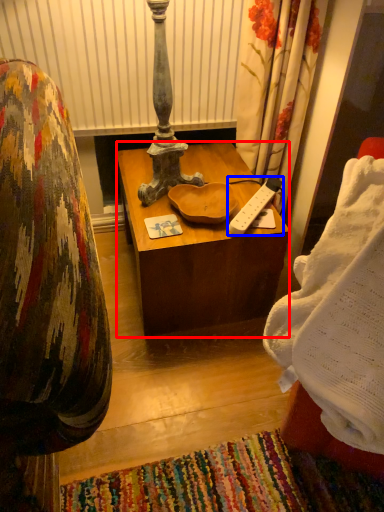
Question: Among these objects, which one is nearest to the camera, desk (highlighted by a red box) or remote control (highlighted by a blue box)?

Choices:
 (A) desk
 (B) remote control

Answer: (A)